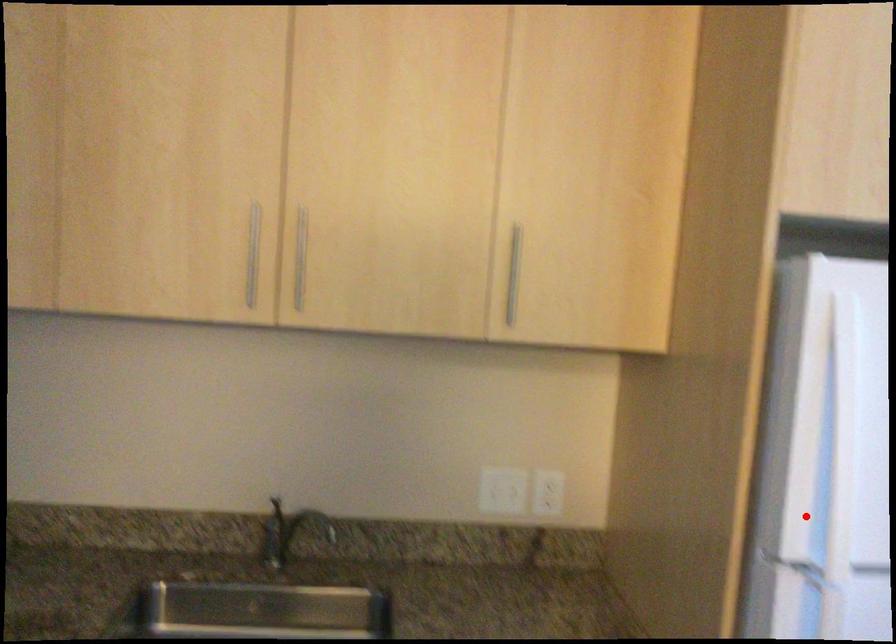
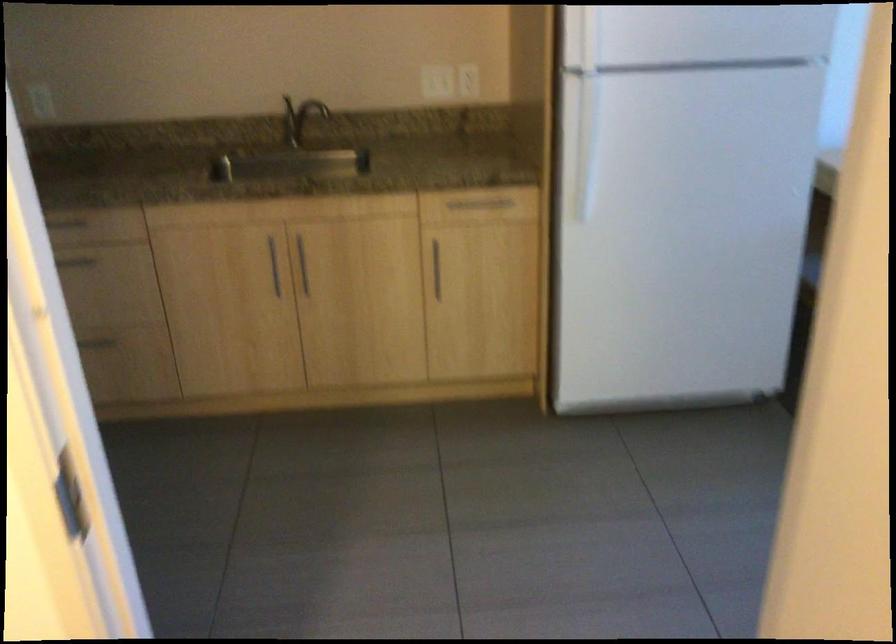
Locate, in the second image, the point that corresponds to the highlighted location in the first image.

(581, 39)